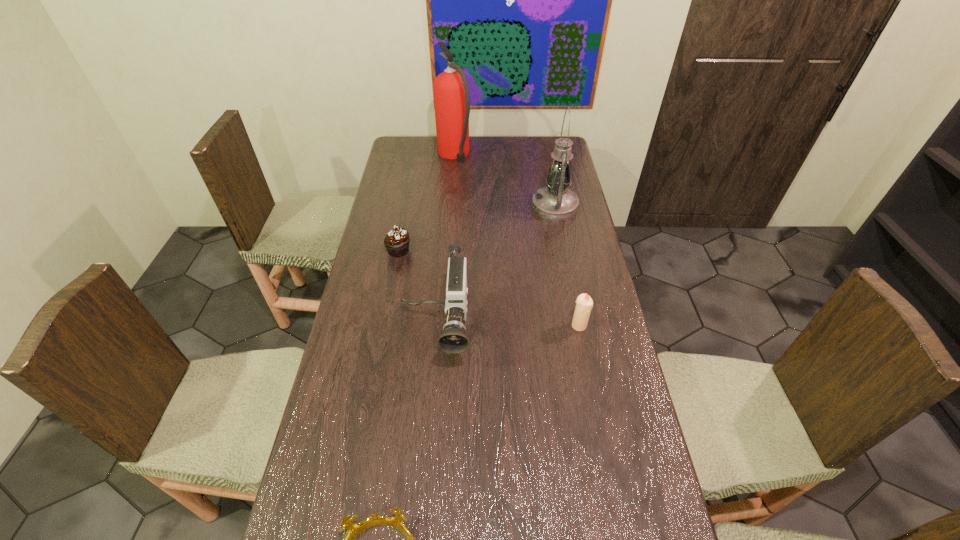
This screenshot has height=540, width=960. I want to click on fire extinguisher, so click(451, 92).

Locate an element on the screen. oil lamp is located at coordinates (556, 202).

Locate an element on the screen. Image resolution: width=960 pixels, height=540 pixels. the third tallest object is located at coordinates (453, 339).

Locate an element on the screen. The height and width of the screenshot is (540, 960). the fourth tallest object is located at coordinates (584, 303).

The height and width of the screenshot is (540, 960). I want to click on cupcake, so click(396, 241).

Locate an element on the screen. Image resolution: width=960 pixels, height=540 pixels. the fourth nearest object is located at coordinates (396, 241).

Locate an element on the screen. vacant space located on the left of the fifth nearest object is located at coordinates (509, 206).

Locate an element on the screen. Image resolution: width=960 pixels, height=540 pixels. free point located 0.260m on the recording direction of the camcorder is located at coordinates (423, 472).

The image size is (960, 540). What are the coordinates of `free region located 0.350m on the back of the candle` in the screenshot? It's located at (564, 245).

Identify the location of free spot located on the back of the cupcake. [x=410, y=187].